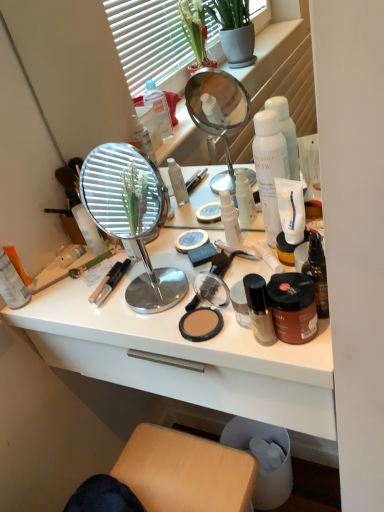
At what (x,y) coordinates should I click in order to perform the action: click on free region on the left part of white matte spray can at center right, which is the second product in bottom-to-top order. Please return your answer as a coordinate pair (x, y). Looking at the image, I should click on (189, 263).